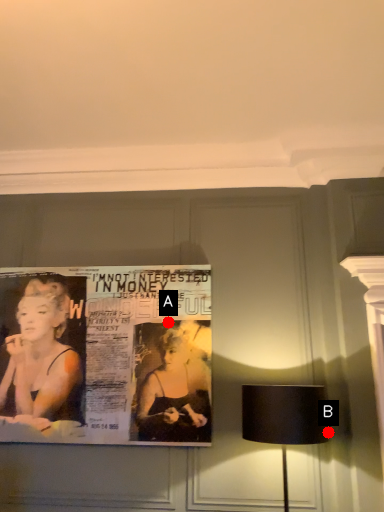
Question: Two points are circled on the image, labeled by A and B beside each circle. Among these points, which one is farthest from the camera?

Choices:
 (A) A is further
 (B) B is further

Answer: (A)